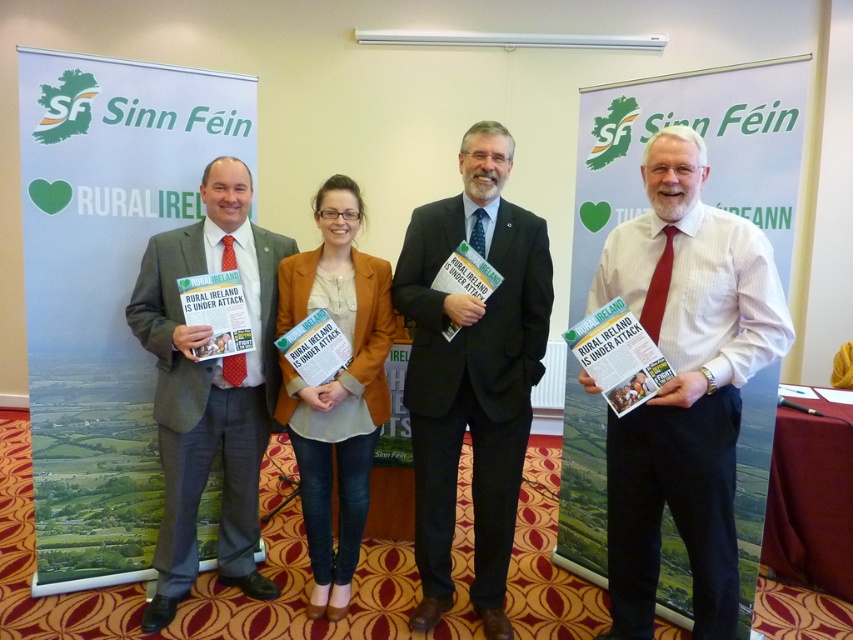
Based on the photo, you are organizing a photo shoot and need to ensure that the white striped shirt at center and the dark blue suit at center are visible in the frame. Given their sizes, which one might require more space to fully capture in the photo?

The dark blue suit at center is wider than the white striped shirt at center, so it might require more space to fully capture in the photo.

You are attending a press conference and need to hand a document to the person in the dark blue suit at center. Looking at the group, where should you approach from relative to the white striped shirt at center?

You should approach from the left side of the white striped shirt at center because the white striped shirt at center is to the right of the dark blue suit at center.

You are attending a press conference at the Sinn Fein event. You need to move from your current position to the exit located at the point with coordinates point [410,625]. There is an obstacle at point [318,262]. Can you safely navigate to the exit without passing through the obstacle?

Point [410,625] is in front of point [318,262], so yes, you can safely navigate to the exit at point [410,625] without passing through the obstacle at point [318,262] because the exit is positioned in front of the obstacle from your perspective.